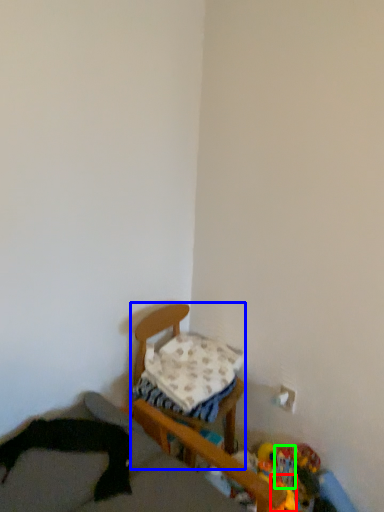
Question: Which object is the closest to the toy (highlighted by a red box)? Choose among these: furniture (highlighted by a blue box) or toy (highlighted by a green box).

Choices:
 (A) furniture
 (B) toy

Answer: (B)